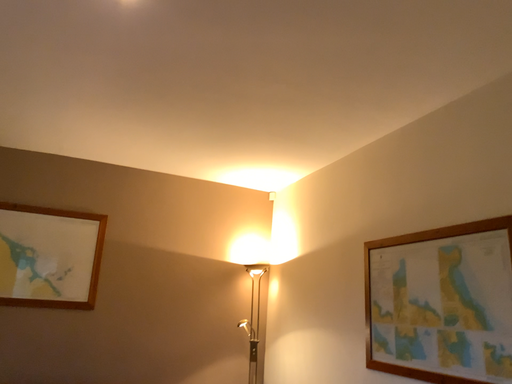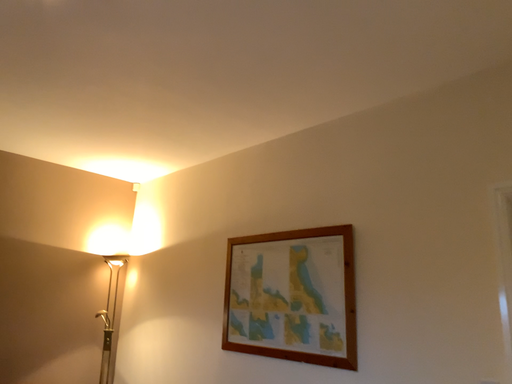
Question: How did the camera likely rotate when shooting the video?

Choices:
 (A) rotated right
 (B) rotated left

Answer: (A)